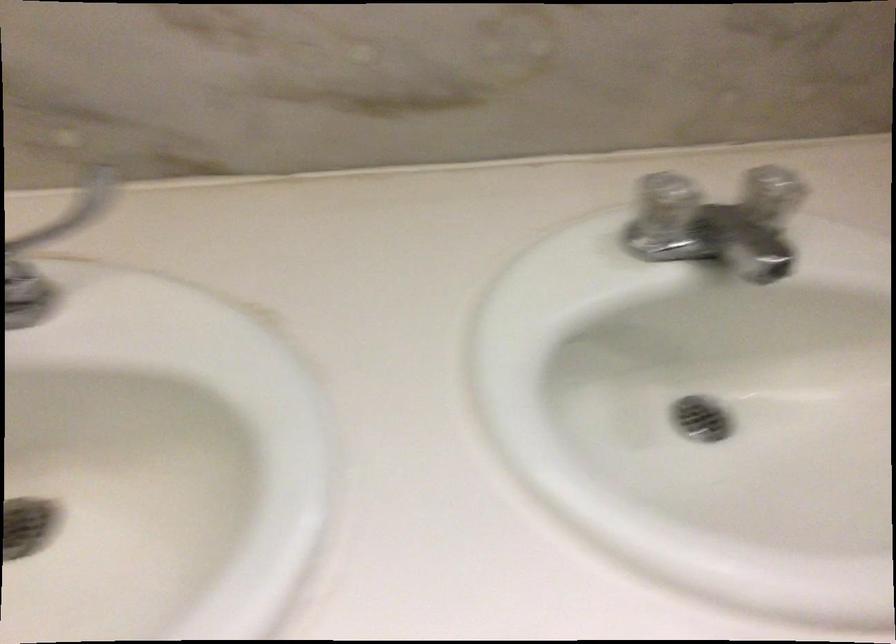
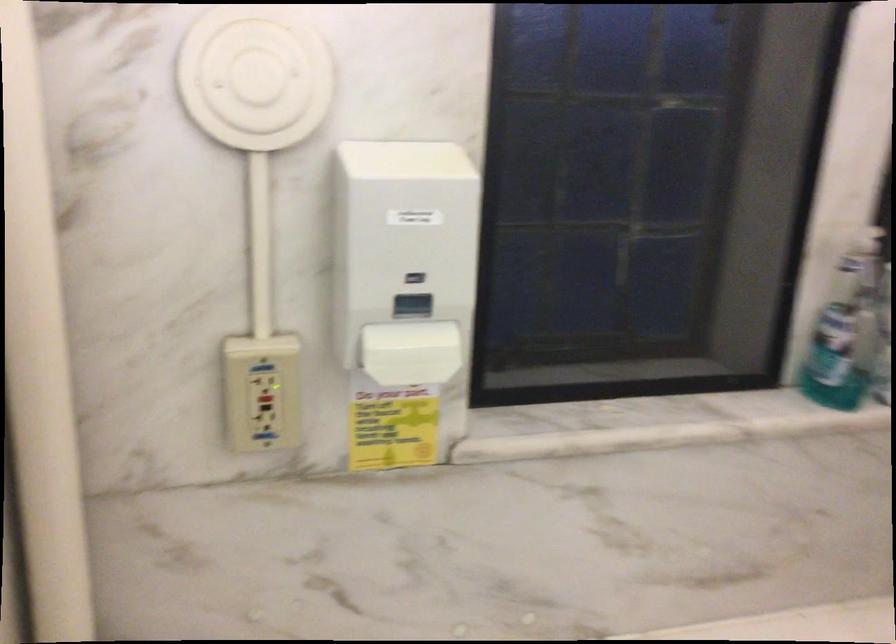
Question: Based on the continuous images, in which direction is the camera rotating? Reply with the corresponding letter.

Choices:
 (A) Left
 (B) Right
 (C) Up
 (D) Down

Answer: (C)